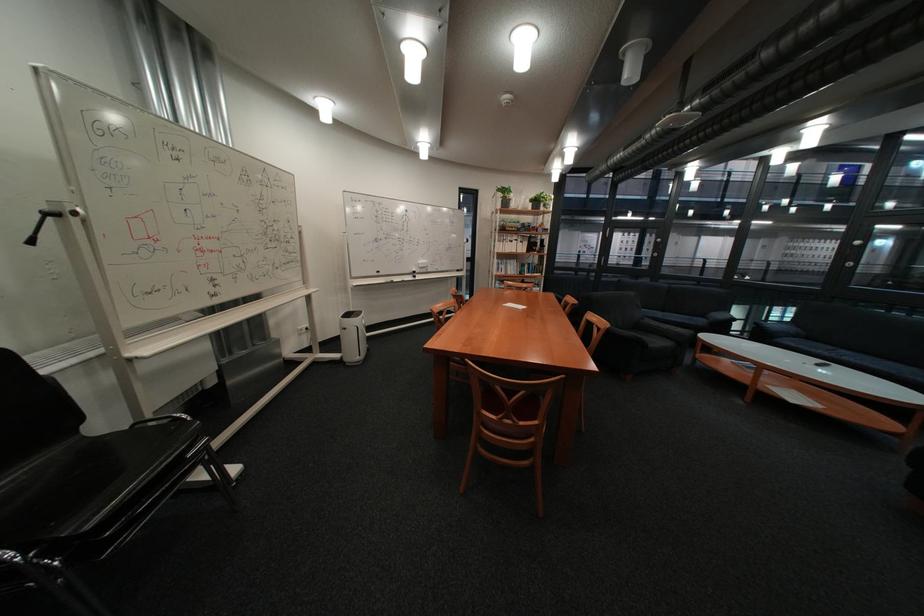
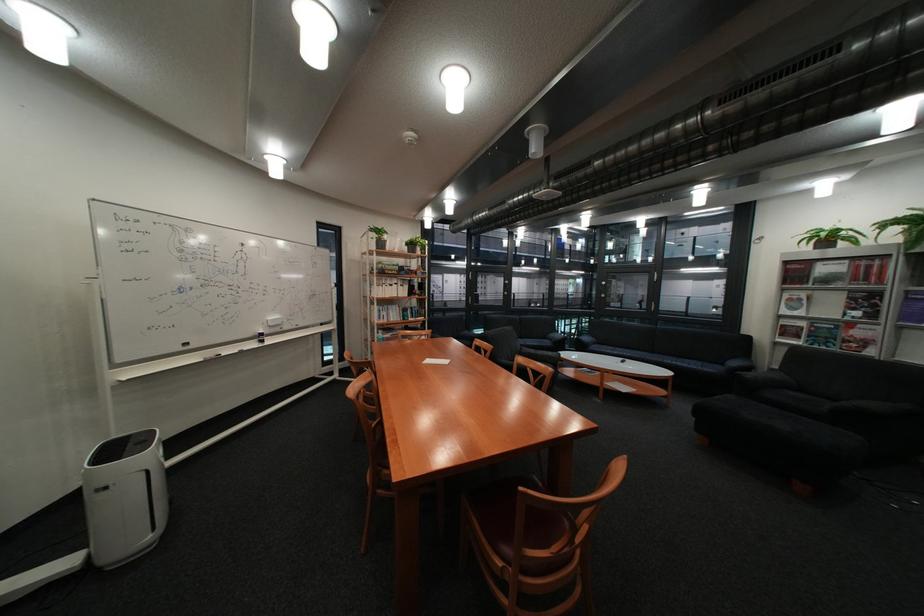
Question: The first image is from the beginning of the video and the second image is from the end. How did the camera likely rotate when shooting the video?

Choices:
 (A) Left
 (B) Right
 (C) Up
 (D) Down

Answer: (B)